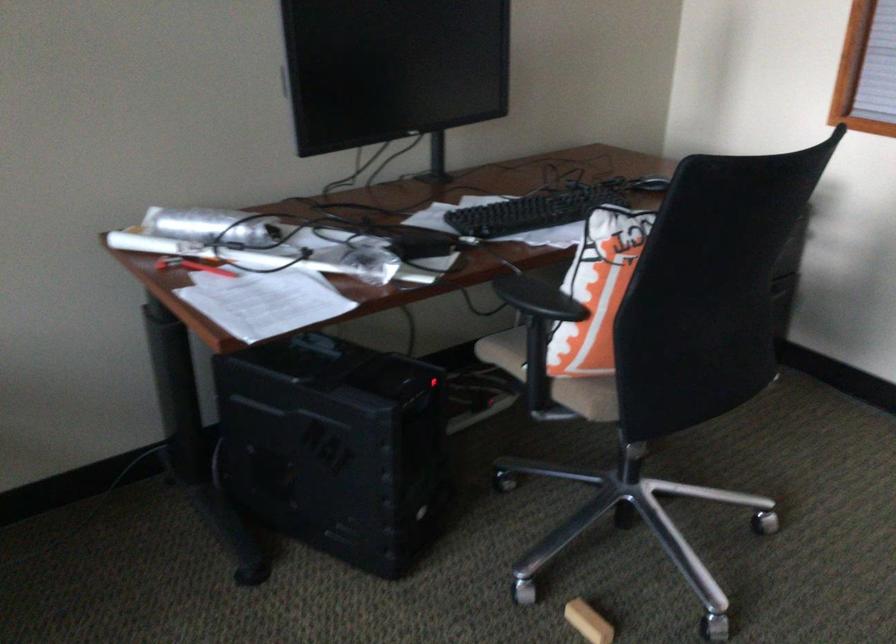
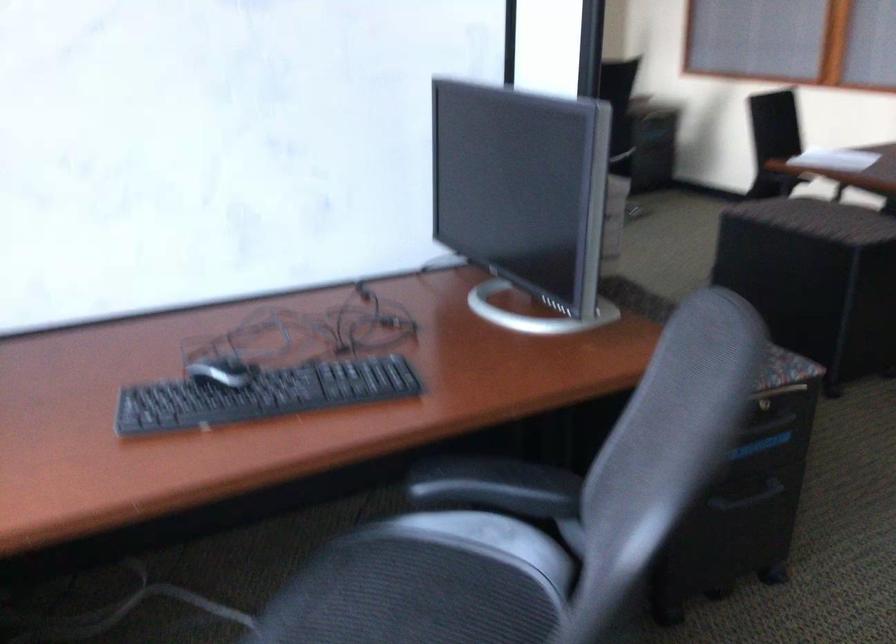
Question: I am providing you with two images of the same scene from different viewpoints. After the viewpoint changes to image2, which objects are now occluded?

Choices:
 (A) computer mouse
 (B) black handle screwdriver
 (C) black chair armrest
 (D) chair sitting surface

Answer: (C)